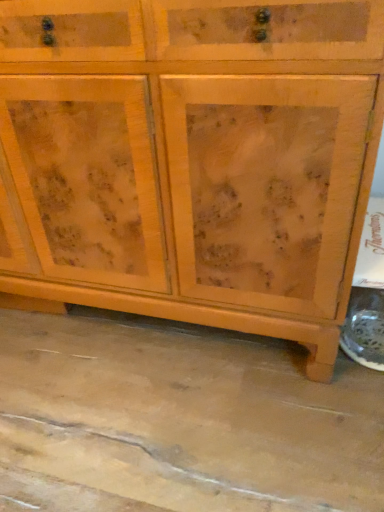
Question: Should I look upward or downward to see natural wood cabinet at center?

Choices:
 (A) up
 (B) down

Answer: (A)